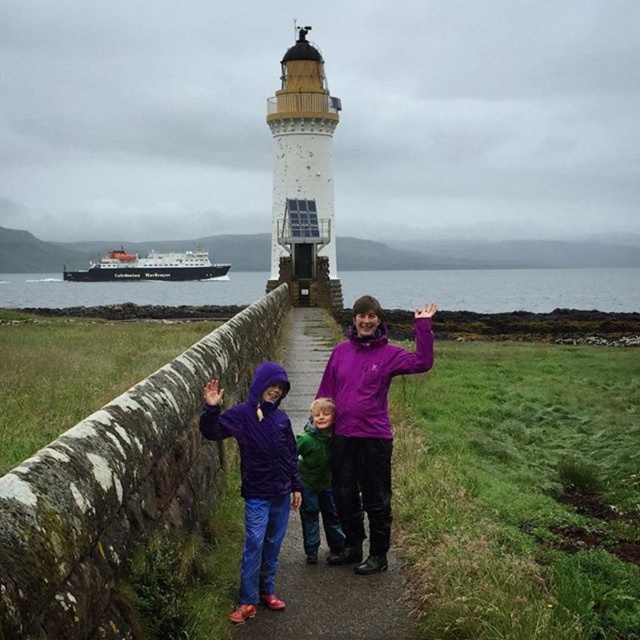
Question: In this image, where is clear water at center located relative to purple fleece jacket at center?

Choices:
 (A) right
 (B) left

Answer: (B)

Question: Considering the real-world distances, which object is farthest from the purple fabric jacket at center?

Choices:
 (A) white matte ferry at center
 (B) clear water at center

Answer: (A)

Question: Which point appears closest to the camera in this image?

Choices:
 (A) (300, 435)
 (B) (508, 276)
 (C) (284, 401)
 (D) (96, 280)

Answer: (A)

Question: Does purple fleece jacket at center appear over green matte jacket at center?

Choices:
 (A) yes
 (B) no

Answer: (A)

Question: Which point is closer to the camera?

Choices:
 (A) (433, 349)
 (B) (100, 262)
 (C) (493, 291)

Answer: (A)

Question: Does green matte jacket at center appear on the left side of white matte ferry at center?

Choices:
 (A) no
 (B) yes

Answer: (A)